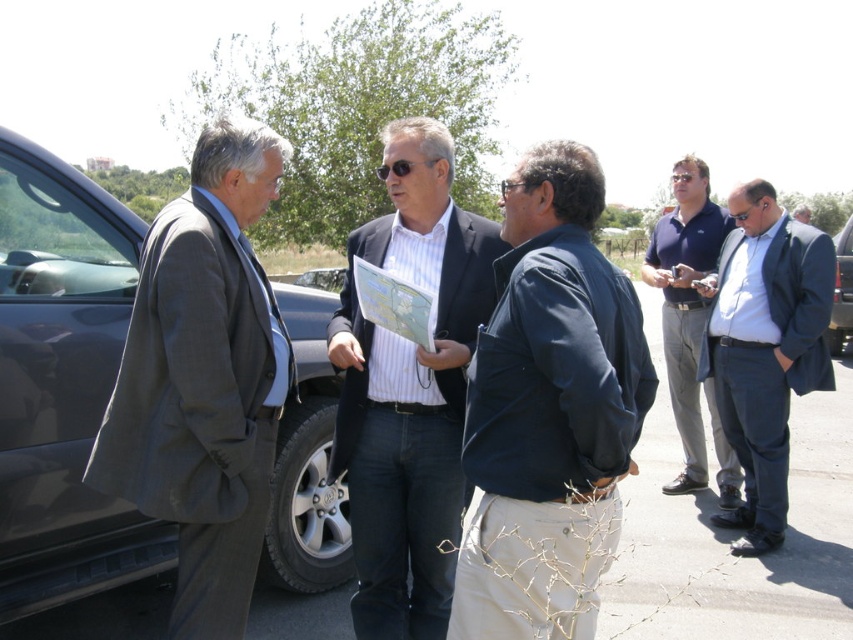
You are organizing a photo shoot and need to ensure that the matte black suit at center and the light blue shirt at upper right are both visible in the frame. Based on their sizes, which object should you focus on to ensure both are in the shot?

The matte black suit at center occupies less space than the light blue shirt at upper right, so focusing on the light blue shirt at upper right will help ensure both are visible in the frame since it is larger and can serve as a reference point.

You are standing at point [750,253] and want to walk to the vehicle located at point [358,413]. Is the vehicle in front of you or behind you?

The vehicle located at point [358,413] is in front of you because point [358,413] is in front of point [750,253].

The scene shows a group of people near a vehicle on a sunny day. There is a point at coordinates (409, 388). Which object in the scene does this point correspond to?

The point at coordinates (409, 388) corresponds to the matte black suit at center.